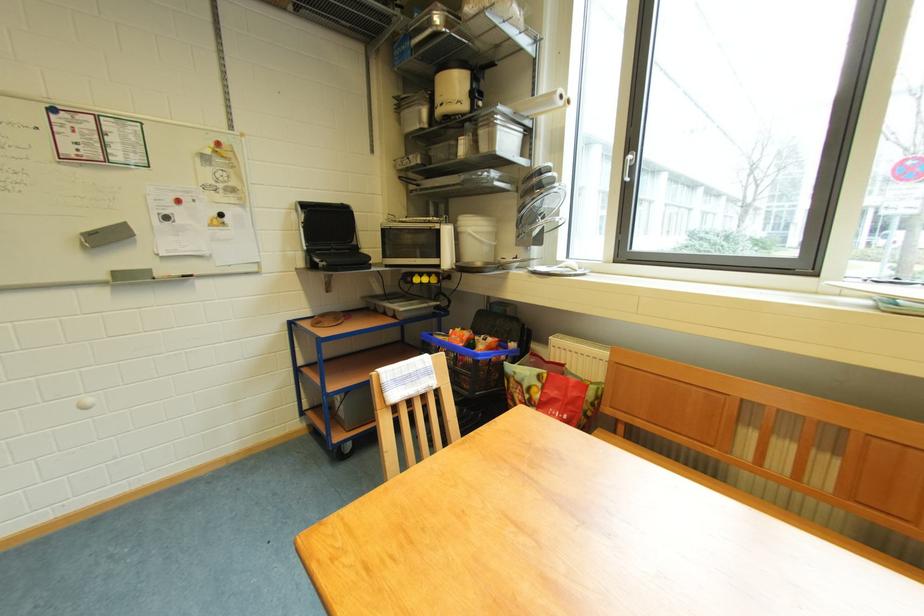
Find the location of a particular element. This screenshot has width=924, height=616. oven door handle is located at coordinates coord(411,228).